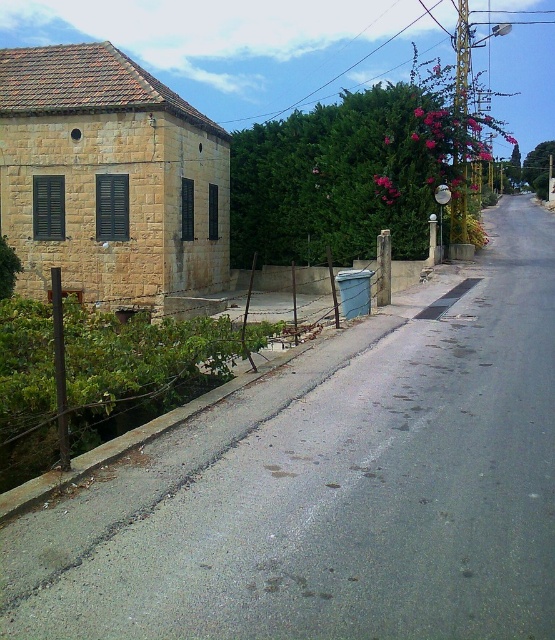
Question: Does gray asphalt road at center have a larger size compared to yellow stone building at left?

Choices:
 (A) yes
 (B) no

Answer: (B)

Question: Which point is farther to the camera?

Choices:
 (A) (508, 240)
 (B) (42, 54)

Answer: (A)

Question: Which of the following is the closest to the observer?

Choices:
 (A) (183, 544)
 (B) (166, 262)

Answer: (A)

Question: Is gray asphalt road at center smaller than yellow stone building at left?

Choices:
 (A) yes
 (B) no

Answer: (A)

Question: Where is gray asphalt road at center located in relation to yellow stone building at left in the image?

Choices:
 (A) below
 (B) above

Answer: (A)